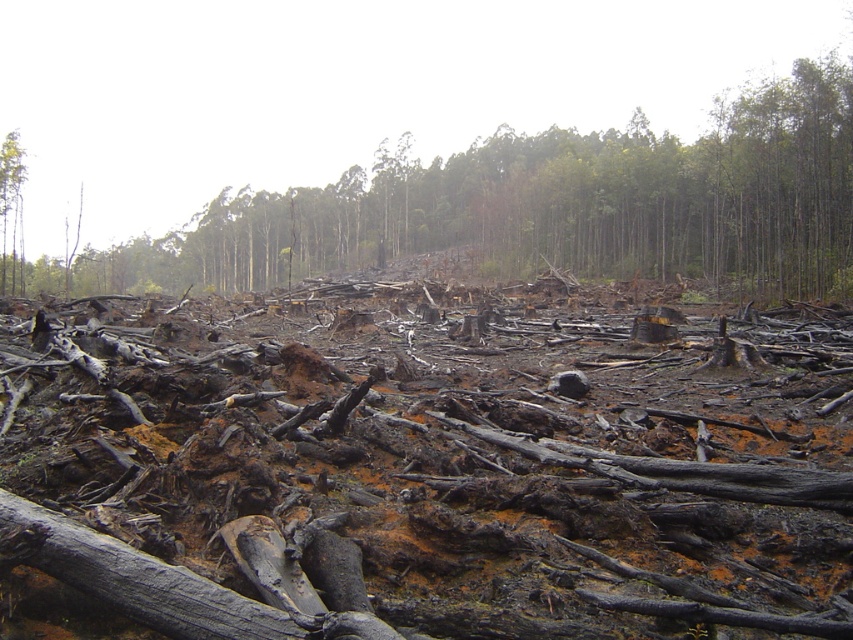
Question: Can you confirm if charcoal wood debris at center is positioned above brown wood tree at left?

Choices:
 (A) no
 (B) yes

Answer: (B)

Question: Does charcoal wood debris at center lie behind brown wood tree at left?

Choices:
 (A) yes
 (B) no

Answer: (B)

Question: Among these objects, which one is nearest to the camera?

Choices:
 (A) brown wood tree at left
 (B) charcoal wood debris at center

Answer: (B)

Question: Does charcoal wood debris at center appear over brown wood tree at left?

Choices:
 (A) yes
 (B) no

Answer: (A)